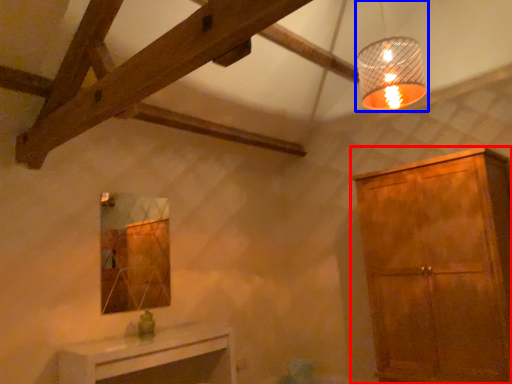
Question: Which object appears farthest to the camera in this image, cabinetry (highlighted by a red box) or lamp (highlighted by a blue box)?

Choices:
 (A) cabinetry
 (B) lamp

Answer: (A)